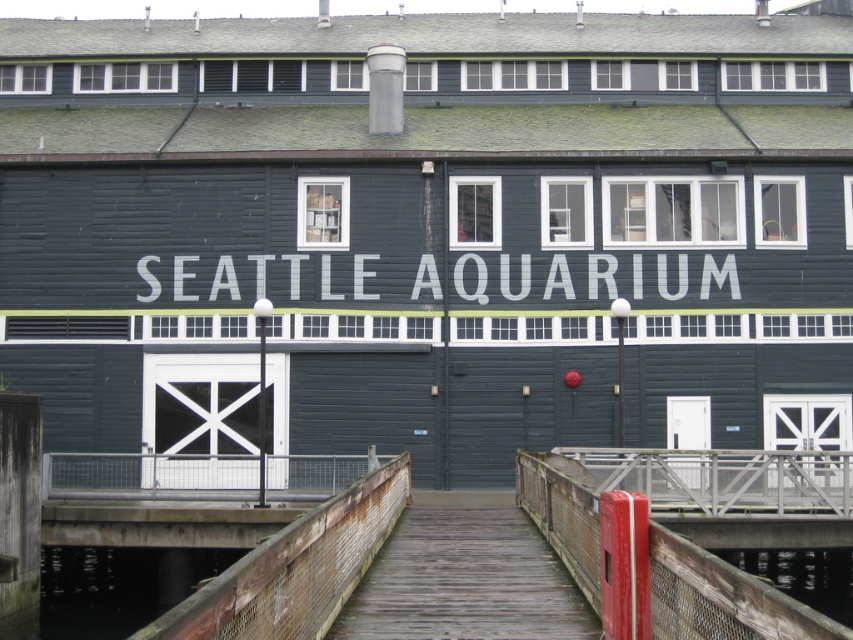
Does white painted wood sign at center appear on the left side of transparent glass water at lower right?

Correct, you'll find white painted wood sign at center to the left of transparent glass water at lower right.

Can you confirm if white painted wood sign at center is shorter than transparent glass water at lower right?

Yes, white painted wood sign at center is shorter than transparent glass water at lower right.

Does point (636, 282) come farther from viewer compared to point (804, 568)?

Yes, it is behind point (804, 568).

This screenshot has height=640, width=853. I want to click on white painted wood sign at center, so click(x=593, y=276).